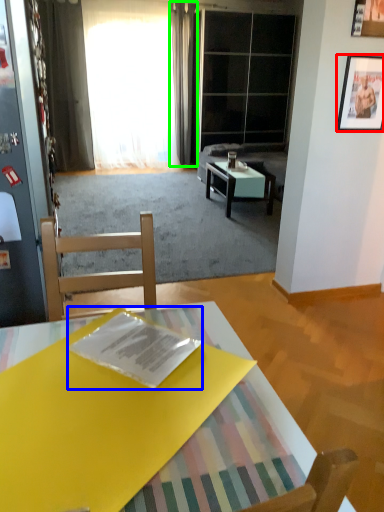
Question: Considering the real-world distances, which object is closest to picture frame (highlighted by a red box)? magazine (highlighted by a blue box) or curtain (highlighted by a green box).

Choices:
 (A) magazine
 (B) curtain

Answer: (A)